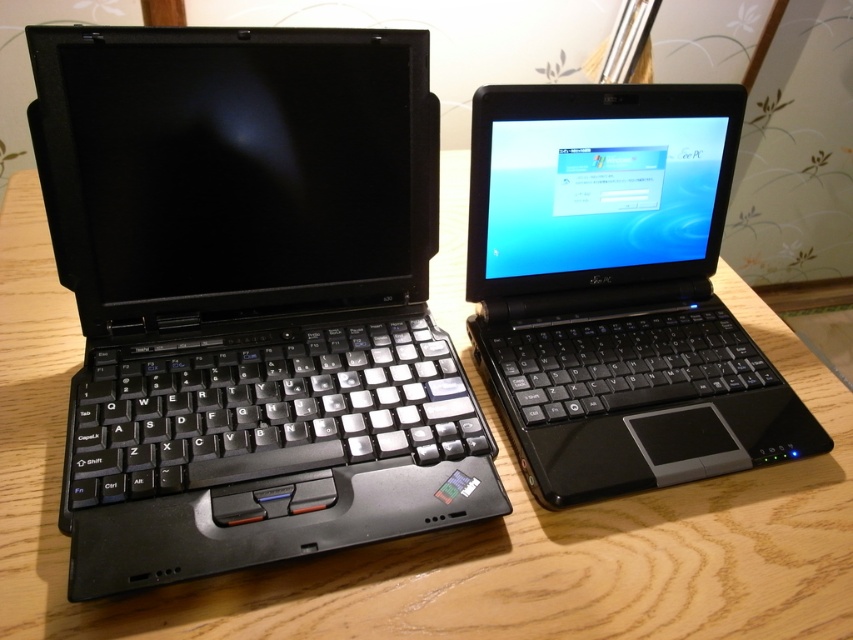
Question: Which point is farther to the camera?

Choices:
 (A) tap(194, 586)
 (B) tap(566, 301)
 (C) tap(178, 35)

Answer: (B)

Question: Is wooden table at center bigger than black plastic laptop at center?

Choices:
 (A) yes
 (B) no

Answer: (A)

Question: Considering the real-world distances, which object is closest to the wooden table at center?

Choices:
 (A) black plastic laptop at center
 (B) black matte keyboard at left

Answer: (A)

Question: Is black matte keyboard at left above wooden table at center?

Choices:
 (A) no
 (B) yes

Answer: (B)

Question: From the image, what is the correct spatial relationship of black matte keyboard at left in relation to black plastic laptop at center?

Choices:
 (A) right
 (B) left

Answer: (B)

Question: Which point is closer to the camera?

Choices:
 (A) (669, 552)
 (B) (65, 464)
 (C) (531, 356)

Answer: (B)